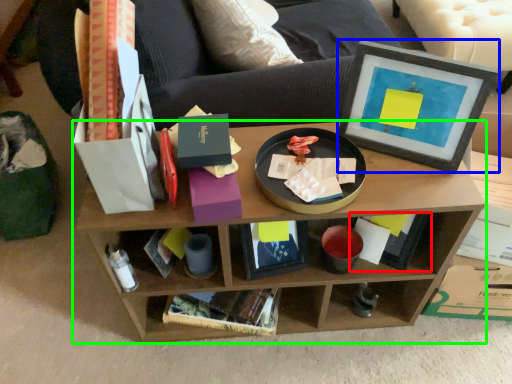
Question: Which object is the closest to the book (highlighted by a red box)? Choose among these: picture frame (highlighted by a blue box) or shelf (highlighted by a green box).

Choices:
 (A) picture frame
 (B) shelf

Answer: (B)